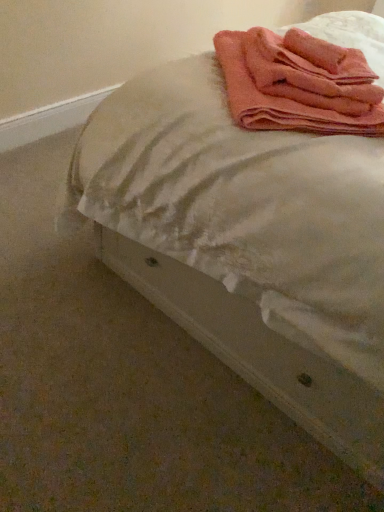
The height and width of the screenshot is (512, 384). Identify the location of pink terry cloth towel at upper right. (295, 88).

Image resolution: width=384 pixels, height=512 pixels. Describe the element at coordinates (295, 88) in the screenshot. I see `pink terry cloth towel at upper right` at that location.

What is the approximate width of pink terry cloth towel at upper right?

The width of pink terry cloth towel at upper right is 16.72 inches.

Locate an element on the screen. pink terry cloth towel at upper right is located at coordinates (295, 88).